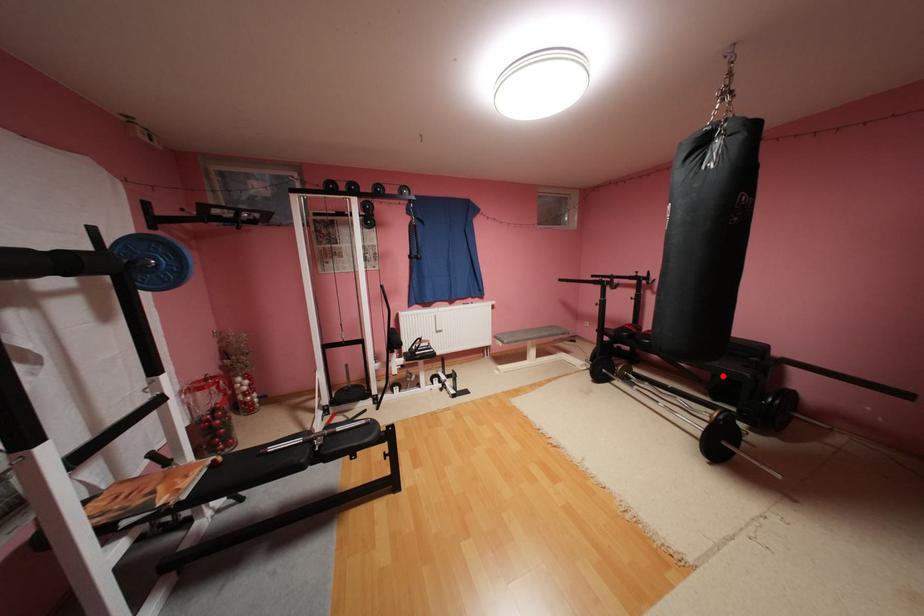
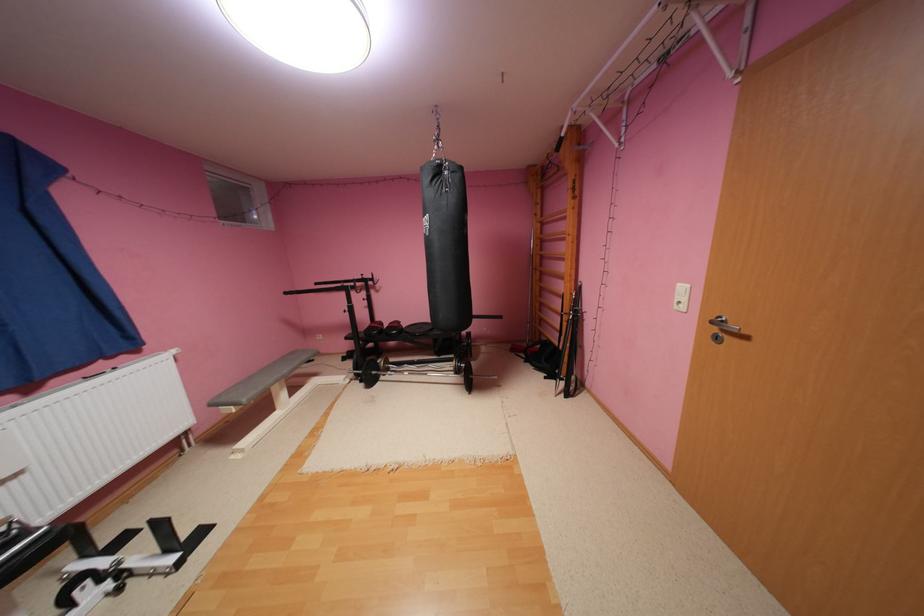
Locate, in the second image, the point that corresponds to the highlighted location in the first image.

(444, 339)